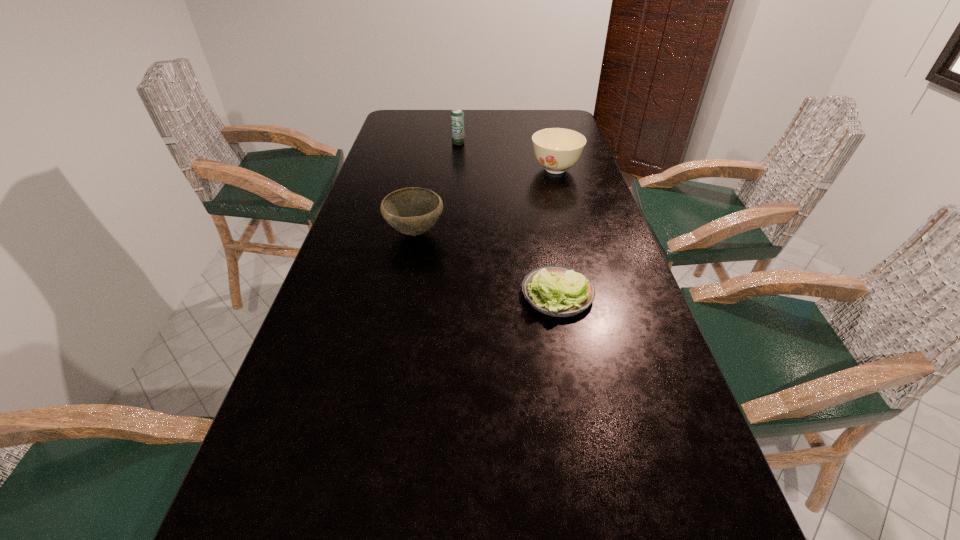
This screenshot has width=960, height=540. I want to click on vacant space in between the beer can and the sugar bowl, so click(x=507, y=156).

Find the location of a particular element. Image resolution: width=960 pixels, height=540 pixels. empty space that is in between the third nearest object and the bowl is located at coordinates (485, 201).

The image size is (960, 540). What are the coordinates of `free space between the shortest object and the sugar bowl` in the screenshot? It's located at (557, 232).

Locate an element on the screen. Image resolution: width=960 pixels, height=540 pixels. free spot between the bowl and the third nearest object is located at coordinates (485, 201).

This screenshot has width=960, height=540. I want to click on free spot between the nearest object and the sugar bowl, so click(557, 232).

At what (x,y) coordinates should I click in order to perform the action: click on vacant space in between the second farthest object and the lettuce. Please return your answer as a coordinate pair (x, y). Image resolution: width=960 pixels, height=540 pixels. Looking at the image, I should click on (557, 232).

Identify the location of object that ranks as the closest to the farthest object. The height and width of the screenshot is (540, 960). (556, 149).

Identify the location of the closest object to the sugar bowl. The height and width of the screenshot is (540, 960). (457, 116).

Where is `free spot that satisfies the following two spatial constraints: 1. on the back side of the sugar bowl; 2. on the left side of the shortest object`? free spot that satisfies the following two spatial constraints: 1. on the back side of the sugar bowl; 2. on the left side of the shortest object is located at coordinates (534, 170).